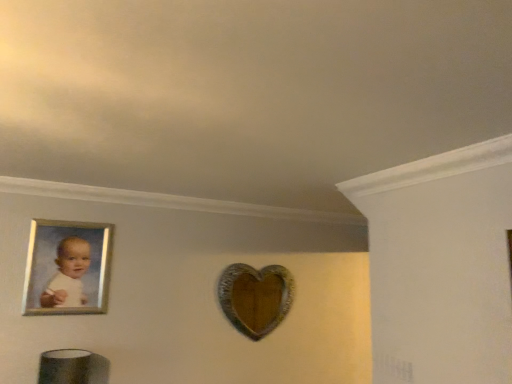
Question: Is silver metallic picture frame at upper left next to wooden heart at center?

Choices:
 (A) yes
 (B) no

Answer: (B)

Question: Considering the relative sizes of silver metallic picture frame at upper left and wooden heart at center in the image provided, is silver metallic picture frame at upper left shorter than wooden heart at center?

Choices:
 (A) no
 (B) yes

Answer: (B)

Question: Is silver metallic picture frame at upper left closer to the viewer compared to wooden heart at center?

Choices:
 (A) yes
 (B) no

Answer: (A)

Question: Is silver metallic picture frame at upper left further to the viewer compared to wooden heart at center?

Choices:
 (A) yes
 (B) no

Answer: (B)

Question: From a real-world perspective, is silver metallic picture frame at upper left over wooden heart at center?

Choices:
 (A) no
 (B) yes

Answer: (B)

Question: Is silver metallic picture frame at upper left at the right side of wooden heart at center?

Choices:
 (A) yes
 (B) no

Answer: (B)

Question: Does wooden heart at center have a larger size compared to silver metallic picture frame at upper left?

Choices:
 (A) no
 (B) yes

Answer: (B)

Question: From a real-world perspective, is wooden heart at center positioned over silver metallic picture frame at upper left based on gravity?

Choices:
 (A) no
 (B) yes

Answer: (A)

Question: Does wooden heart at center lie in front of silver metallic picture frame at upper left?

Choices:
 (A) no
 (B) yes

Answer: (A)

Question: From the image's perspective, does wooden heart at center appear lower than silver metallic picture frame at upper left?

Choices:
 (A) yes
 (B) no

Answer: (A)

Question: Can you confirm if wooden heart at center is wider than silver metallic picture frame at upper left?

Choices:
 (A) yes
 (B) no

Answer: (A)

Question: Is wooden heart at center positioned with its back to silver metallic picture frame at upper left?

Choices:
 (A) yes
 (B) no

Answer: (B)

Question: From a real-world perspective, is wooden heart at center above or below silver metallic picture frame at upper left?

Choices:
 (A) above
 (B) below

Answer: (B)